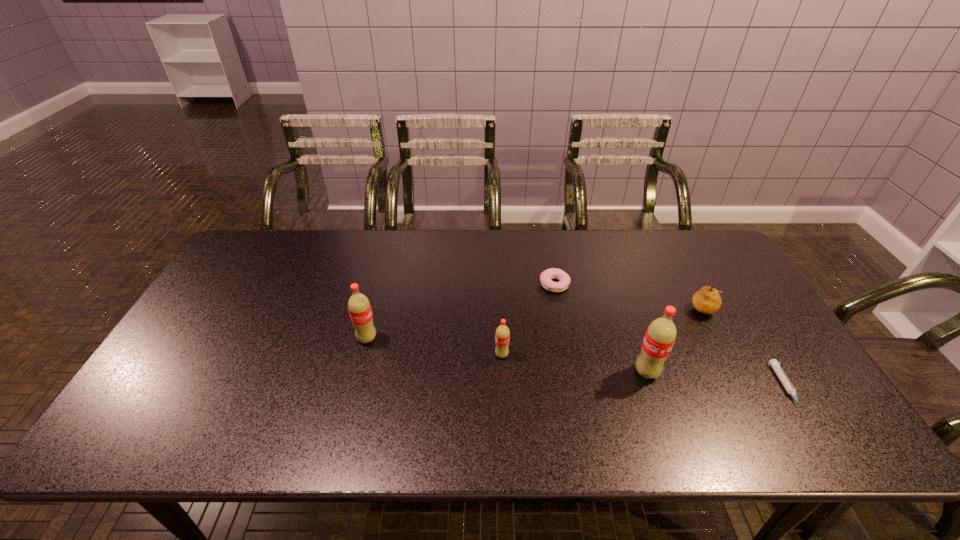
Locate an element on the screen. The height and width of the screenshot is (540, 960). syringe that is at the right edge is located at coordinates (775, 364).

The image size is (960, 540). Identify the location of object situated at the near right corner. (775, 364).

This screenshot has height=540, width=960. In the image, there is a desktop. Find the location of `free space at the far edge`. free space at the far edge is located at coordinates (576, 252).

Find the location of a particular element. This screenshot has width=960, height=540. blank space at the near edge of the desktop is located at coordinates (715, 392).

In the image, there is a desktop. Where is `free space at the left edge`? free space at the left edge is located at coordinates (243, 298).

Where is `blank space at the right edge of the desktop`? Image resolution: width=960 pixels, height=540 pixels. blank space at the right edge of the desktop is located at coordinates (737, 294).

Where is `free spot at the far left corner of the desktop`? free spot at the far left corner of the desktop is located at coordinates (239, 251).

At what (x,y) coordinates should I click in order to perform the action: click on blank space at the far right corner of the desktop. Please return your answer as a coordinate pair (x, y). The width and height of the screenshot is (960, 540). Looking at the image, I should click on (697, 262).

Find the location of `free spot between the rightmost soda and the second farthest soda`. free spot between the rightmost soda and the second farthest soda is located at coordinates (574, 363).

Image resolution: width=960 pixels, height=540 pixels. I want to click on free space between the second object from right to left and the third object from left to right, so click(631, 297).